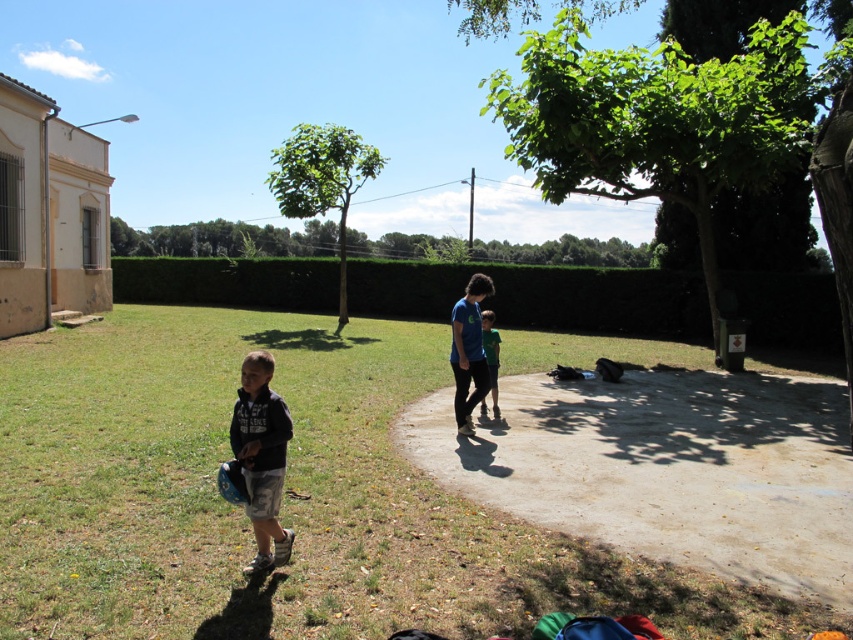
Between dark gray cotton shirt at lower left and green matte shirt at center, which one appears on the right side from the viewer's perspective?

Positioned to the right is green matte shirt at center.

Does dark gray cotton shirt at lower left have a lesser height compared to green matte shirt at center?

No, dark gray cotton shirt at lower left is not shorter than green matte shirt at center.

Is point (273, 433) positioned after point (491, 324)?

No, it is not.

This screenshot has height=640, width=853. I want to click on dark gray cotton shirt at lower left, so click(x=260, y=456).

Which is below, dirt path at center or dark gray cotton shirt at lower left?

dirt path at center is lower down.

Which of these two, dirt path at center or dark gray cotton shirt at lower left, stands shorter?

Standing shorter between the two is dirt path at center.

Which is in front, point (572, 436) or point (283, 448)?

Point (283, 448) is in front.

You are a GUI agent. You are given a task and a screenshot of the screen. Output one action in this format:
    pyautogui.click(x=<x>, y=<y>)
    Task: Click on the dirt path at center
    This screenshot has height=640, width=853.
    Given the screenshot: What is the action you would take?
    pyautogui.click(x=666, y=468)

Who is positioned more to the right, dirt path at center or green matte shirt at center?

From the viewer's perspective, dirt path at center appears more on the right side.

Is dirt path at center smaller than green matte shirt at center?

Incorrect, dirt path at center is not smaller in size than green matte shirt at center.

Measure the distance between point (737, 547) and camera.

Point (737, 547) and camera are 4.92 meters apart.

Locate an element on the screen. dirt path at center is located at coordinates (666, 468).